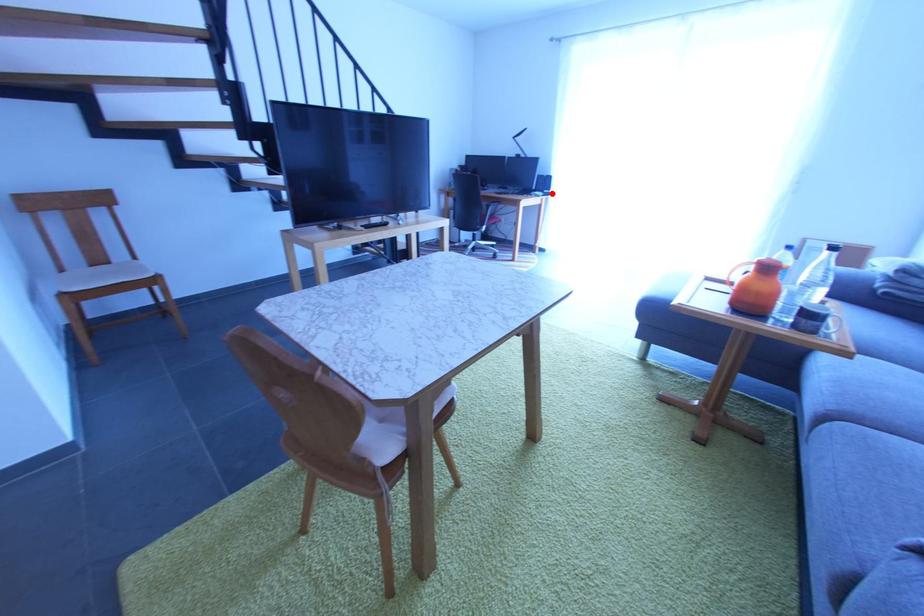
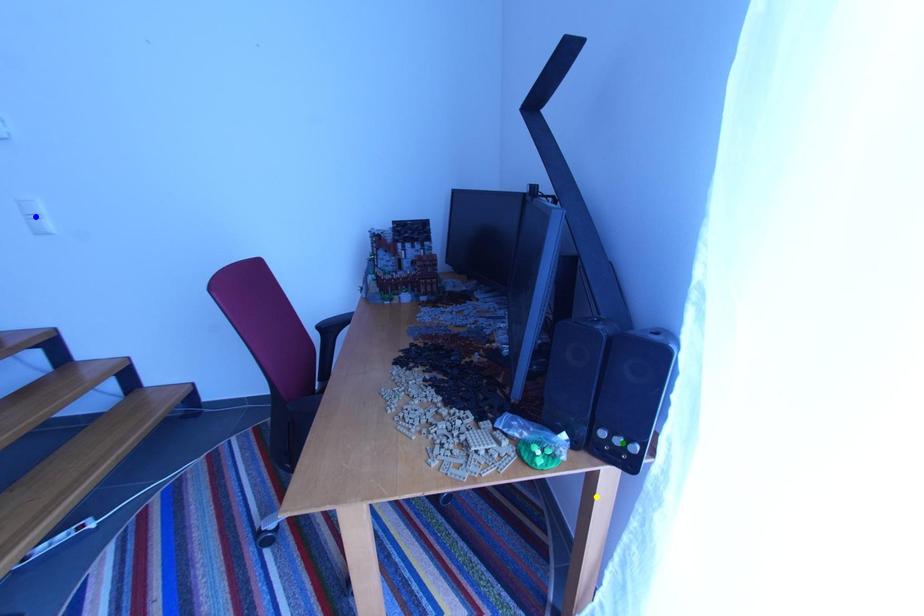
Question: I am providing you with two images of the same scene from different viewpoints. A red point is marked on the first image. You are given multiple points on the second image. Which spot in image 2 lines up with the point in image 1?

Choices:
 (A) blue point
 (B) green point
 (C) yellow point

Answer: (B)